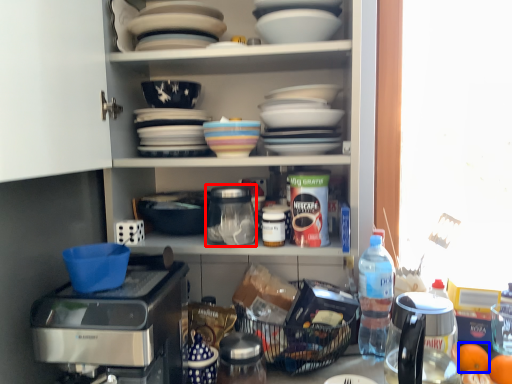
Question: Which object is further to the camera taking this photo, appliance (highlighted by a red box) or tangerine (highlighted by a blue box)?

Choices:
 (A) appliance
 (B) tangerine

Answer: (B)